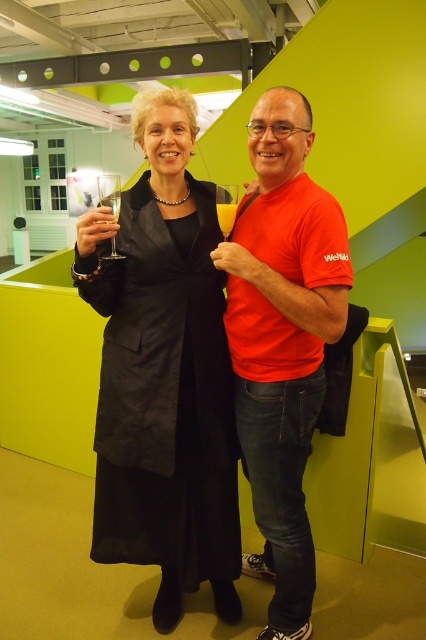
You are a photographer setting up a camera in this scene. You need to ensure that both the black matte coat at center and the translucent glass at upper center are fully visible in the frame. Based on their sizes, is there a risk that one might block the view of the other?

The black matte coat at center might be wider than translucent glass at upper center, so there is a risk that the black matte coat at center could block the view of the translucent glass at upper center if positioned between them.